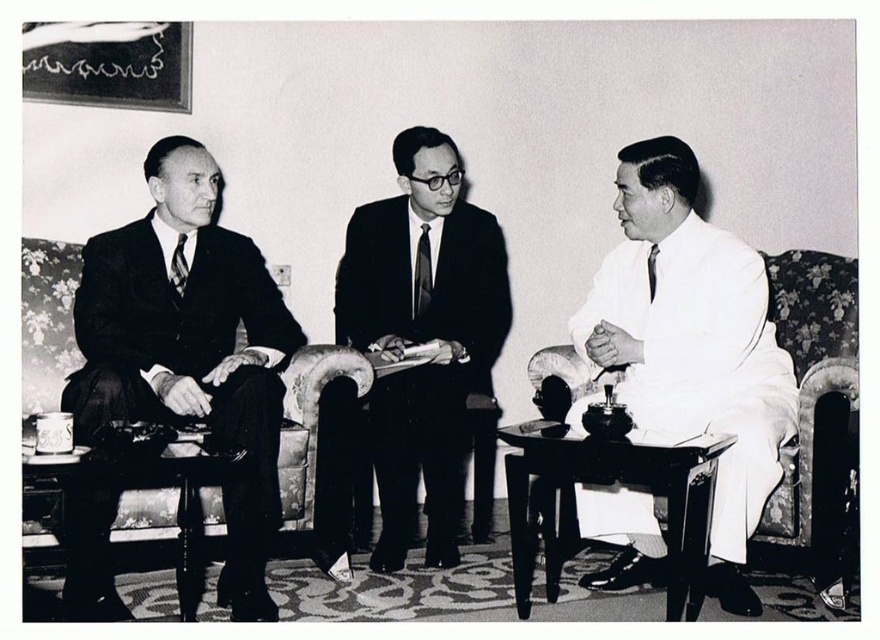
In the image, there are three men in formal attire. The man on the left is in a dark suit and tie, the central figure is standing with a document, and the third man is wearing a white robe. Which of the three men is represented by the point at coordinates (x=422, y=336)?

The point at coordinates (x=422, y=336) represents the matte black suit at center, which is the central figure standing with a document.

Looking at this image, you are a photographer who needs to place a name tag on the wooden table at center. To ensure the name tag is visible from the current camera angle, should you place it closer to the edge facing the matte black tie at left or the opposite edge?

The wooden table at center is located below matte black tie at left, so placing the name tag closer to the edge facing the matte black tie at left would ensure it is visible from the current camera angle.

You are a photographer adjusting lighting for the scene. You need to ensure that both the wooden table at center and the matte black tie at left are well lit. Given their height difference, which object should you adjust the light intensity for first to avoid shadows?

The wooden table at center is much taller than the matte black tie at left, so you should adjust the light intensity for the wooden table at center first to ensure proper lighting without casting shadows on the lower matte black tie at left.